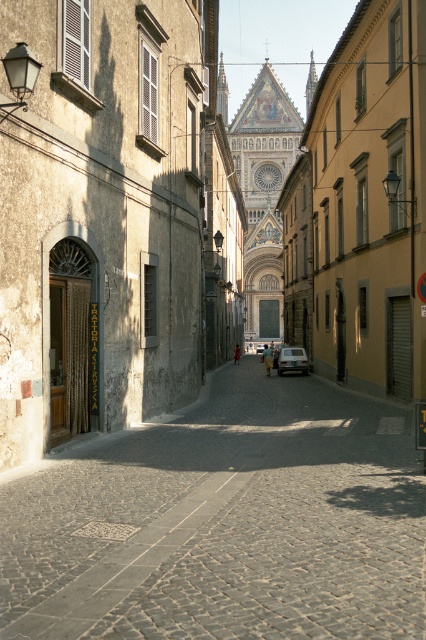
You are driving a car and want to park in the gray cobblestone alley at center. However, there is a silver metallic car at center blocking the entrance. Based on their positions, can you drive into the alley without moving the car?

The gray cobblestone alley at center is to the left of the silver metallic car at center, so the car is blocking the entrance. You cannot drive into the alley without moving the car.

You are driving a silver metallic car at center and want to park it on the stone paved street at center. Is the street wide enough to accommodate the car?

The stone paved street at center is wider than the silver metallic car at center, so yes, the car can be parked there.